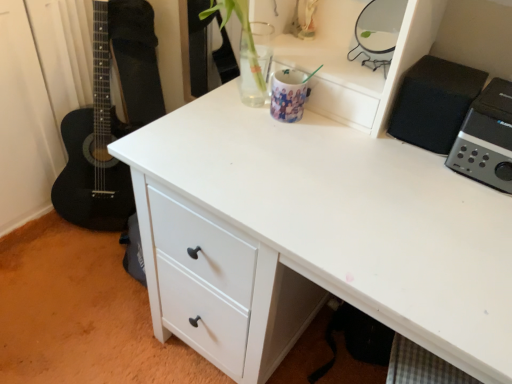
Find the location of a particular element. The image size is (512, 384). glossy ceramic mug at upper center, marked as the first appliance in a left-to-right arrangement is located at coordinates (288, 95).

The height and width of the screenshot is (384, 512). What do you see at coordinates (486, 138) in the screenshot? I see `silver metallic speaker at upper right, the fourth appliance from the left` at bounding box center [486, 138].

Where is `glossy ceramic mug at upper center, marked as the first appliance in a left-to-right arrangement`? This screenshot has width=512, height=384. glossy ceramic mug at upper center, marked as the first appliance in a left-to-right arrangement is located at coordinates (288, 95).

Is metallic silver mirror at upper right, acting as the 3th appliance starting from the right, positioned far away from black matte speaker at upper right, which ranks as the third appliance in left-to-right order?

No, metallic silver mirror at upper right, acting as the 3th appliance starting from the right, is in close proximity to black matte speaker at upper right, which ranks as the third appliance in left-to-right order.

From the image's perspective, does metallic silver mirror at upper right, acting as the 3th appliance starting from the right, appear lower than black matte speaker at upper right, the second appliance from the right?

No, from the image's perspective, metallic silver mirror at upper right, acting as the 3th appliance starting from the right, is not beneath black matte speaker at upper right, the second appliance from the right.

Is metallic silver mirror at upper right, acting as the 2th appliance starting from the left, at the left side of glossy ceramic mug at upper center, arranged as the fourth appliance when viewed from the right?

Incorrect, metallic silver mirror at upper right, acting as the 2th appliance starting from the left, is not on the left side of glossy ceramic mug at upper center, arranged as the fourth appliance when viewed from the right.

Is metallic silver mirror at upper right, acting as the 3th appliance starting from the right, positioned behind glossy ceramic mug at upper center, arranged as the fourth appliance when viewed from the right?

No, it is not.

From the picture: Is metallic silver mirror at upper right, acting as the 3th appliance starting from the right, not near glossy ceramic mug at upper center, arranged as the fourth appliance when viewed from the right?

No.

Is metallic silver mirror at upper right, acting as the 3th appliance starting from the right, spatially inside glossy ceramic mug at upper center, marked as the first appliance in a left-to-right arrangement, or outside of it?

metallic silver mirror at upper right, acting as the 3th appliance starting from the right, is spatially situated outside glossy ceramic mug at upper center, marked as the first appliance in a left-to-right arrangement.

Is glossy ceramic mug at upper center, arranged as the fourth appliance when viewed from the right, facing towards metallic silver mirror at upper right, acting as the 3th appliance starting from the right?

No.

Consider the image. Between glossy ceramic mug at upper center, marked as the first appliance in a left-to-right arrangement, and metallic silver mirror at upper right, acting as the 2th appliance starting from the left, which one has larger width?

With larger width is metallic silver mirror at upper right, acting as the 2th appliance starting from the left.

From the image's perspective, starting from the metallic silver mirror at upper right, acting as the 3th appliance starting from the right, which appliance is the 1st one below? Please provide its 2D coordinates.

[(288, 95)]

From the image's perspective, which one is positioned lower, glossy ceramic mug at upper center, arranged as the fourth appliance when viewed from the right, or metallic silver mirror at upper right, acting as the 2th appliance starting from the left?

glossy ceramic mug at upper center, arranged as the fourth appliance when viewed from the right.

Consider the image. Is black matte speaker at upper right, the second appliance from the right, not inside glossy ceramic mug at upper center, arranged as the fourth appliance when viewed from the right?

Indeed, black matte speaker at upper right, the second appliance from the right, is completely outside glossy ceramic mug at upper center, arranged as the fourth appliance when viewed from the right.

What's the angular difference between black matte speaker at upper right, the second appliance from the right, and glossy ceramic mug at upper center, marked as the first appliance in a left-to-right arrangement,'s facing directions?

They differ by 0.14 degrees in their facing directions.

From the picture: Would you say black matte speaker at upper right, the second appliance from the right, is to the left or to the right of glossy ceramic mug at upper center, arranged as the fourth appliance when viewed from the right, in the picture?

Based on their positions, black matte speaker at upper right, the second appliance from the right, is located to the right of glossy ceramic mug at upper center, arranged as the fourth appliance when viewed from the right.

Is point (443, 147) closer or farther from the camera than point (293, 118)?

Point (443, 147).

From the image's perspective, would you say black matte speaker at upper right, which ranks as the third appliance in left-to-right order, is shown under metallic silver mirror at upper right, acting as the 2th appliance starting from the left?

Yes.

Which is farther, (434, 141) or (365, 41)?

The point (365, 41) is farther from the camera.

Is black matte speaker at upper right, which ranks as the third appliance in left-to-right order, to the right of metallic silver mirror at upper right, acting as the 3th appliance starting from the right, from the viewer's perspective?

Yes, black matte speaker at upper right, which ranks as the third appliance in left-to-right order, is to the right of metallic silver mirror at upper right, acting as the 3th appliance starting from the right.

This screenshot has width=512, height=384. I want to click on appliance above the black matte speaker at upper right, which ranks as the third appliance in left-to-right order (from a real-world perspective), so click(378, 31).

Does point (488, 171) lie behind point (390, 27)?

No, (488, 171) is in front of (390, 27).

This screenshot has height=384, width=512. There is a silver metallic speaker at upper right, the fourth appliance from the left. What are the coordinates of `the 3rd appliance above it (from the image's perspective)` in the screenshot? It's located at (378, 31).

From a real-world perspective, who is located lower, silver metallic speaker at upper right, which ranks as the 1th appliance in right-to-left order, or metallic silver mirror at upper right, acting as the 3th appliance starting from the right?

In real-world perspective, silver metallic speaker at upper right, which ranks as the 1th appliance in right-to-left order, is lower.

How distant is silver metallic speaker at upper right, which ranks as the 1th appliance in right-to-left order, from metallic silver mirror at upper right, acting as the 3th appliance starting from the right?

A distance of 12.24 inches exists between silver metallic speaker at upper right, which ranks as the 1th appliance in right-to-left order, and metallic silver mirror at upper right, acting as the 3th appliance starting from the right.

From a real-world perspective, is metallic silver mirror at upper right, acting as the 3th appliance starting from the right, positioned under silver metallic speaker at upper right, the fourth appliance from the left, based on gravity?

No, from a real-world perspective, metallic silver mirror at upper right, acting as the 3th appliance starting from the right, is not below silver metallic speaker at upper right, the fourth appliance from the left.

Find the location of a particular element. the 2nd appliance to the left of the silver metallic speaker at upper right, the fourth appliance from the left, counting from the anchor's position is located at coordinates (378, 31).

From the image's perspective, which is above, metallic silver mirror at upper right, acting as the 3th appliance starting from the right, or silver metallic speaker at upper right, the fourth appliance from the left?

From the image's view, metallic silver mirror at upper right, acting as the 3th appliance starting from the right, is above.

In the scene shown: Is the depth of metallic silver mirror at upper right, acting as the 2th appliance starting from the left, less than that of silver metallic speaker at upper right, which ranks as the 1th appliance in right-to-left order?

No, it is not.

This screenshot has height=384, width=512. I want to click on appliance that is the 1st object to the left of the black matte speaker at upper right, which ranks as the third appliance in left-to-right order, starting at the anchor, so click(x=378, y=31).

The width and height of the screenshot is (512, 384). Find the location of `the 3rd appliance above the glossy ceramic mug at upper center, arranged as the fourth appliance when viewed from the right (from a real-world perspective)`. the 3rd appliance above the glossy ceramic mug at upper center, arranged as the fourth appliance when viewed from the right (from a real-world perspective) is located at coordinates (378, 31).

Based on their spatial positions, is glossy ceramic mug at upper center, arranged as the fourth appliance when viewed from the right, or black matte speaker at upper right, the second appliance from the right, closer to metallic silver mirror at upper right, acting as the 2th appliance starting from the left?

black matte speaker at upper right, the second appliance from the right, is closer to metallic silver mirror at upper right, acting as the 2th appliance starting from the left.

Considering their positions, is silver metallic speaker at upper right, the fourth appliance from the left, positioned closer to metallic silver mirror at upper right, acting as the 2th appliance starting from the left, than black matte speaker at upper right, which ranks as the third appliance in left-to-right order?

Based on the image, black matte speaker at upper right, which ranks as the third appliance in left-to-right order, appears to be nearer to metallic silver mirror at upper right, acting as the 2th appliance starting from the left.

When comparing their distances from metallic silver mirror at upper right, acting as the 2th appliance starting from the left, does silver metallic speaker at upper right, which ranks as the 1th appliance in right-to-left order, or glossy ceramic mug at upper center, arranged as the fourth appliance when viewed from the right, seem further?

silver metallic speaker at upper right, which ranks as the 1th appliance in right-to-left order, lies further to metallic silver mirror at upper right, acting as the 2th appliance starting from the left, than the other object.

When comparing their distances from metallic silver mirror at upper right, acting as the 3th appliance starting from the right, does glossy ceramic mug at upper center, arranged as the fourth appliance when viewed from the right, or silver metallic speaker at upper right, which ranks as the 1th appliance in right-to-left order, seem closer?

glossy ceramic mug at upper center, arranged as the fourth appliance when viewed from the right, is positioned closer to the anchor metallic silver mirror at upper right, acting as the 3th appliance starting from the right.

Which object lies nearer to the anchor point silver metallic speaker at upper right, the fourth appliance from the left, metallic silver mirror at upper right, acting as the 2th appliance starting from the left, or black matte speaker at upper right, the second appliance from the right?

The object closer to silver metallic speaker at upper right, the fourth appliance from the left, is black matte speaker at upper right, the second appliance from the right.

From the image, which object appears to be nearer to silver metallic speaker at upper right, the fourth appliance from the left, glossy ceramic mug at upper center, arranged as the fourth appliance when viewed from the right, or metallic silver mirror at upper right, acting as the 3th appliance starting from the right?

metallic silver mirror at upper right, acting as the 3th appliance starting from the right, is positioned closer to the anchor silver metallic speaker at upper right, the fourth appliance from the left.

When comparing their distances from black matte speaker at upper right, which ranks as the third appliance in left-to-right order, does glossy ceramic mug at upper center, arranged as the fourth appliance when viewed from the right, or metallic silver mirror at upper right, acting as the 2th appliance starting from the left, seem closer?

Based on the image, metallic silver mirror at upper right, acting as the 2th appliance starting from the left, appears to be nearer to black matte speaker at upper right, which ranks as the third appliance in left-to-right order.

Based on the photo, from the image, which object appears to be nearer to black matte speaker at upper right, which ranks as the third appliance in left-to-right order, silver metallic speaker at upper right, the fourth appliance from the left, or metallic silver mirror at upper right, acting as the 3th appliance starting from the right?

silver metallic speaker at upper right, the fourth appliance from the left, lies closer to black matte speaker at upper right, which ranks as the third appliance in left-to-right order, than the other object.

Where is `appliance between glossy ceramic mug at upper center, marked as the first appliance in a left-to-right arrangement, and black matte speaker at upper right, which ranks as the third appliance in left-to-right order, in the horizontal direction`? The height and width of the screenshot is (384, 512). appliance between glossy ceramic mug at upper center, marked as the first appliance in a left-to-right arrangement, and black matte speaker at upper right, which ranks as the third appliance in left-to-right order, in the horizontal direction is located at coordinates (378, 31).